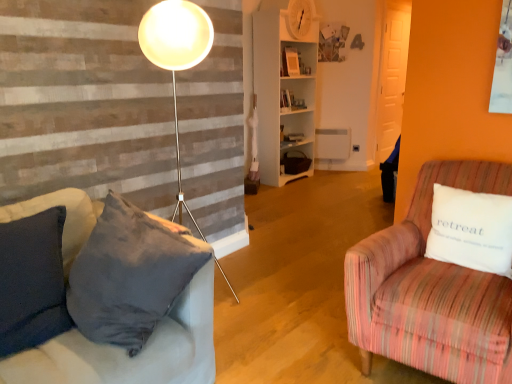
You are a GUI agent. You are given a task and a screenshot of the screen. Output one action in this format:
    pyautogui.click(x=<x>, y=<y>)
    Task: Click on the vacant region to the left of striped fabric armchair at right
    The image size is (512, 384).
    Given the screenshot: What is the action you would take?
    pyautogui.click(x=286, y=334)